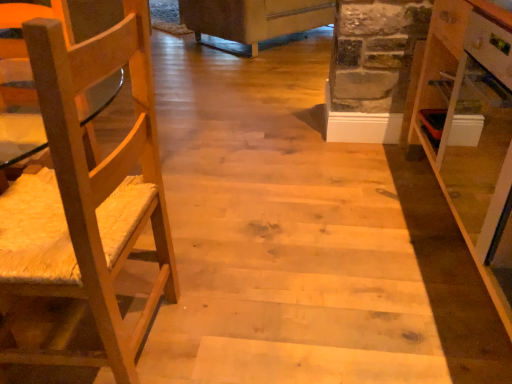
Question: Considering the relative positions of white glossy cabinet at right and natural wood chair at left in the image provided, is white glossy cabinet at right to the right of natural wood chair at left from the viewer's perspective?

Choices:
 (A) no
 (B) yes

Answer: (B)

Question: Is white glossy cabinet at right in front of natural wood chair at left?

Choices:
 (A) no
 (B) yes

Answer: (A)

Question: Can you confirm if white glossy cabinet at right is taller than natural wood chair at left?

Choices:
 (A) no
 (B) yes

Answer: (A)

Question: From the image's perspective, is white glossy cabinet at right located beneath natural wood chair at left?

Choices:
 (A) no
 (B) yes

Answer: (A)

Question: Is white glossy cabinet at right far from natural wood chair at left?

Choices:
 (A) no
 (B) yes

Answer: (B)

Question: Can natural wood chair at left be found inside white glossy cabinet at right?

Choices:
 (A) yes
 (B) no

Answer: (B)

Question: Is white fabric couch at upper center closer to the viewer compared to natural wood chair at left?

Choices:
 (A) no
 (B) yes

Answer: (A)

Question: From the image's perspective, is white fabric couch at upper center located beneath natural wood chair at left?

Choices:
 (A) no
 (B) yes

Answer: (A)

Question: Is white fabric couch at upper center taller than natural wood chair at left?

Choices:
 (A) no
 (B) yes

Answer: (A)

Question: Is white fabric couch at upper center facing away from natural wood chair at left?

Choices:
 (A) no
 (B) yes

Answer: (A)

Question: Is there a large distance between white fabric couch at upper center and natural wood chair at left?

Choices:
 (A) no
 (B) yes

Answer: (B)

Question: Is white fabric couch at upper center outside of natural wood chair at left?

Choices:
 (A) yes
 (B) no

Answer: (A)

Question: Is natural wood chair at left at the right side of white fabric couch at upper center?

Choices:
 (A) no
 (B) yes

Answer: (A)